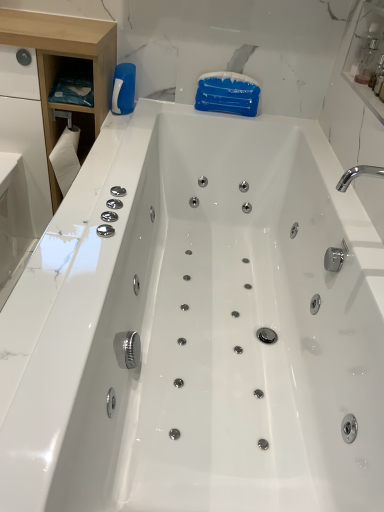
Find the location of `vacant space in front of white plastic bottle at upper left`. vacant space in front of white plastic bottle at upper left is located at coordinates (x=132, y=123).